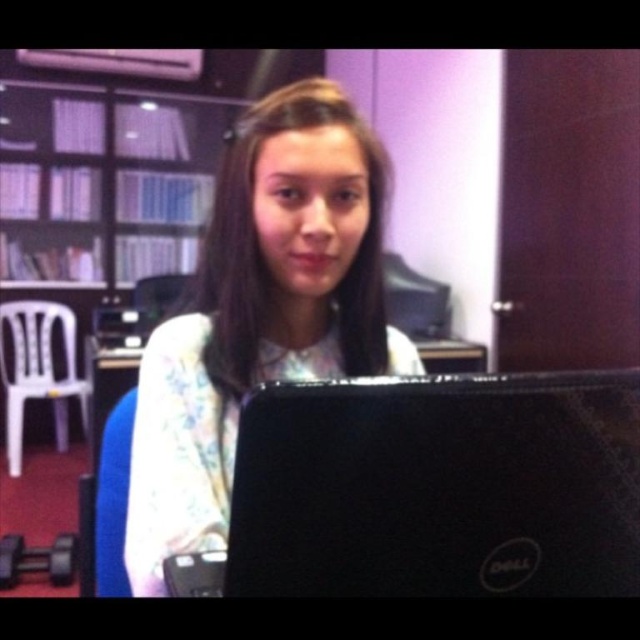
Question: Which object is the closest to the black matte laptop at center?

Choices:
 (A) white floral shirt at center
 (B) matte white bookshelf at upper left

Answer: (A)

Question: Based on their relative distances, which object is farther from the black matte laptop at center?

Choices:
 (A) white floral shirt at center
 (B) matte white bookshelf at upper left

Answer: (B)

Question: Is black matte laptop at center positioned at the back of matte white bookshelf at upper left?

Choices:
 (A) yes
 (B) no

Answer: (B)

Question: Is black matte laptop at center to the left of white floral shirt at center from the viewer's perspective?

Choices:
 (A) yes
 (B) no

Answer: (B)

Question: Considering the real-world distances, which object is closest to the matte white bookshelf at upper left?

Choices:
 (A) black matte laptop at center
 (B) white floral shirt at center

Answer: (B)

Question: Is black matte laptop at center positioned behind white floral shirt at center?

Choices:
 (A) yes
 (B) no

Answer: (B)